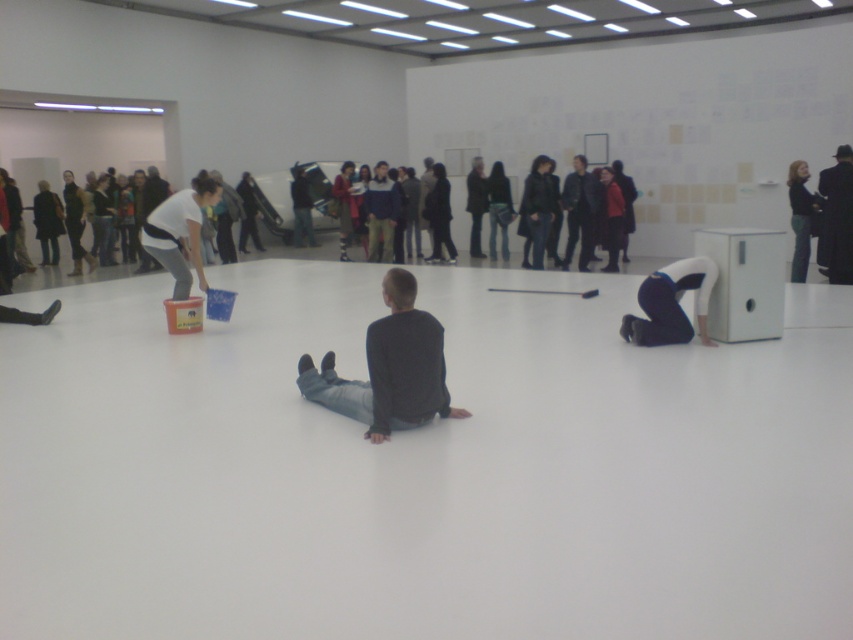
Between black leather hat at upper right and black leather jacket at upper right, which one is positioned lower?

Positioned lower is black leather jacket at upper right.

Is black leather hat at upper right further to the viewer compared to black leather jacket at upper right?

No, it is not.

Is point (845, 186) positioned in front of point (799, 269)?

Yes, it is in front of point (799, 269).

This screenshot has width=853, height=640. I want to click on black leather hat at upper right, so click(x=836, y=218).

Between point (376, 321) and point (848, 282), which one is positioned in front?

Point (376, 321) is more forward.

Describe the element at coordinates (389, 369) in the screenshot. I see `black matte shirt at center` at that location.

Who is more distant from viewer, (390, 346) or (837, 236)?

The point (837, 236) is more distant.

Where is `black matte shirt at center`? The image size is (853, 640). black matte shirt at center is located at coordinates (389, 369).

Can you confirm if matte white shirt at left is bigger than black leather hat at upper right?

Yes, matte white shirt at left is bigger than black leather hat at upper right.

Image resolution: width=853 pixels, height=640 pixels. What do you see at coordinates (180, 232) in the screenshot?
I see `matte white shirt at left` at bounding box center [180, 232].

Is point (178, 205) more distant than point (822, 172)?

No, (178, 205) is closer to viewer.

Image resolution: width=853 pixels, height=640 pixels. What are the coordinates of `matte white shirt at left` in the screenshot? It's located at (x=180, y=232).